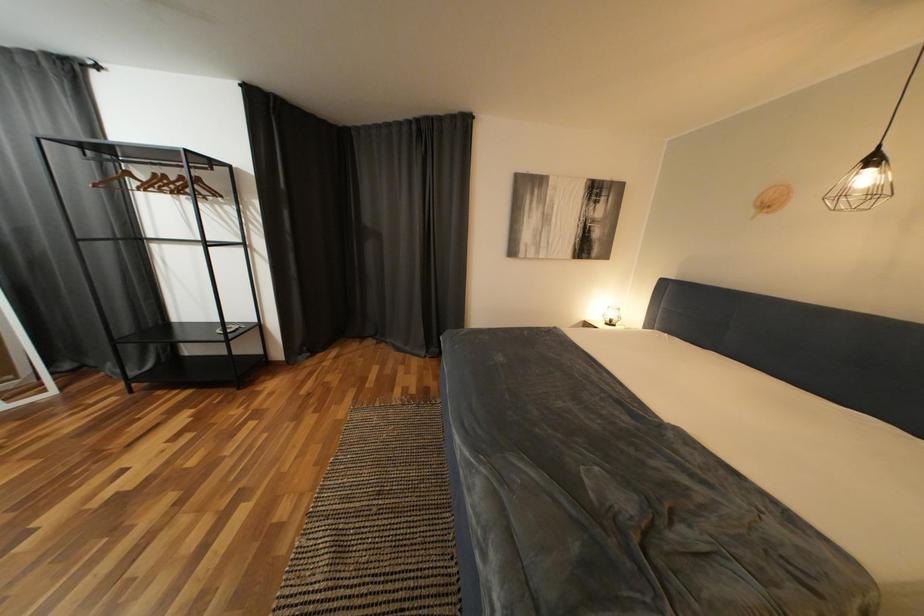
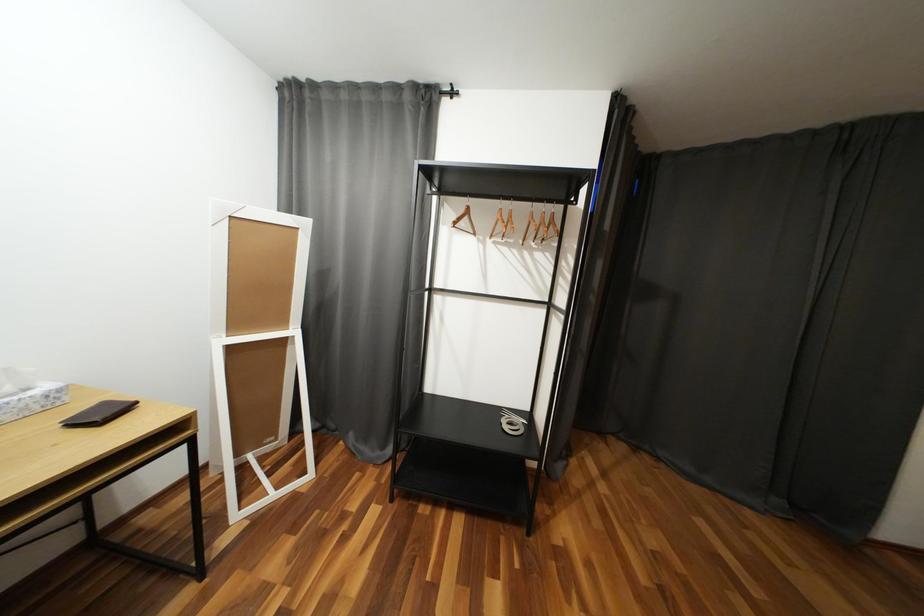
Question: What movement of the cameraman would produce the second image?

Choices:
 (A) Left
 (B) Right
 (C) Forward
 (D) Backward

Answer: (A)